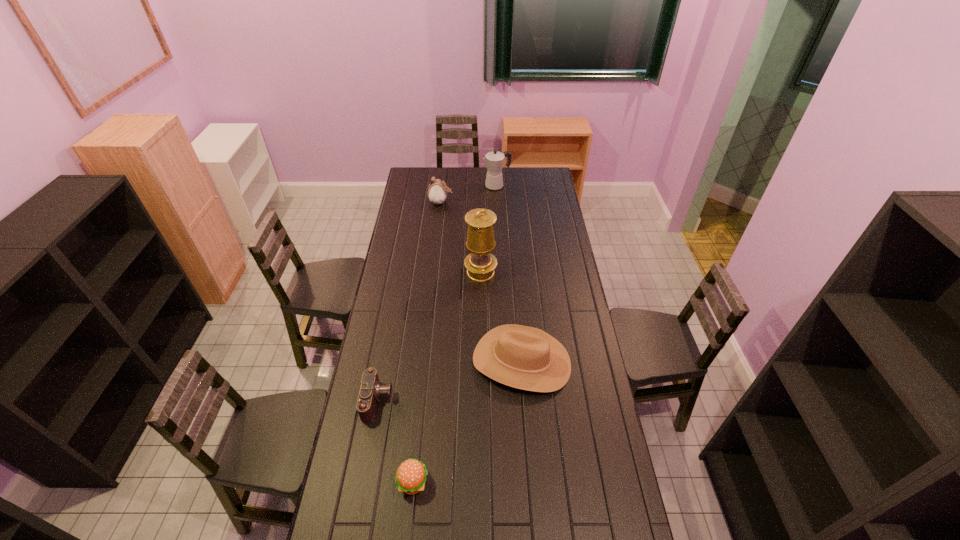
I want to click on object that stands as the second closest to the cowboy hat, so click(410, 478).

The height and width of the screenshot is (540, 960). What are the coordinates of `free space that satisfies the following two spatial constraints: 1. on the back side of the coffeepot; 2. on the right side of the third farthest object` in the screenshot? It's located at (481, 186).

At what (x,y) coordinates should I click in order to perform the action: click on blank space that satisfies the following two spatial constraints: 1. on the front-facing side of the second farthest object; 2. on the left side of the fourth nearest object. Please return your answer as a coordinate pair (x, y). The image size is (960, 540). Looking at the image, I should click on (433, 273).

The image size is (960, 540). Find the location of `blank space that satisfies the following two spatial constraints: 1. on the front-facing side of the fifth nearest object; 2. on the left side of the nearest object`. blank space that satisfies the following two spatial constraints: 1. on the front-facing side of the fifth nearest object; 2. on the left side of the nearest object is located at coordinates (410, 482).

I want to click on free space that satisfies the following two spatial constraints: 1. on the front-facing side of the hamburger; 2. on the right side of the pouch, so click(410, 482).

Locate an element on the screen. This screenshot has width=960, height=540. free spot that satisfies the following two spatial constraints: 1. on the front-facing side of the leftmost object; 2. on the back side of the nearest object is located at coordinates (363, 482).

Where is `vacant region that satisfies the following two spatial constraints: 1. on the back side of the fifth shortest object; 2. on the right side of the oil lamp`? The image size is (960, 540). vacant region that satisfies the following two spatial constraints: 1. on the back side of the fifth shortest object; 2. on the right side of the oil lamp is located at coordinates (481, 186).

This screenshot has height=540, width=960. I want to click on free location that satisfies the following two spatial constraints: 1. on the back side of the hamburger; 2. on the front-facing side of the camera, so click(421, 401).